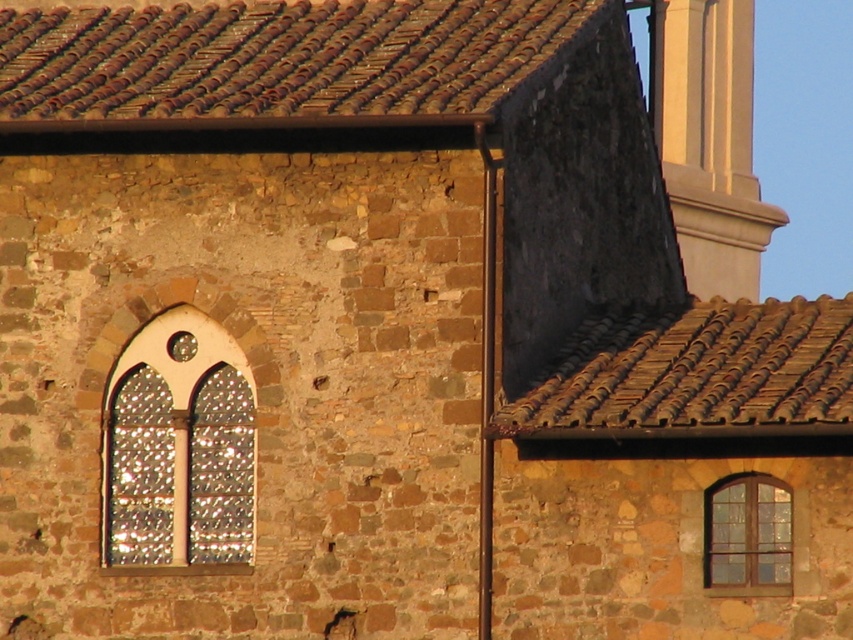
You are a maintenance worker needing to inspect the brown tile roof at upper right and the stained glass window at left. Given that you can only move along the wall, how far apart are these two structures?

The brown tile roof at upper right and the stained glass window at left are 4.66 meters apart from each other.

From the picture: You are standing in front of the stone building and want to locate the stained glass window at left. According to the coordinates provided, where exactly should you look?

The stained glass window at left is located at point (178, 448), so you should look to the left side of the image at that coordinate position.

You are an architect examining the stone building. You notice the brown tile roof at upper right and the stained glass window at left. From your vantage point, which object is positioned to the right of the other?

The brown tile roof at upper right is positioned to the right of the stained glass window at left.